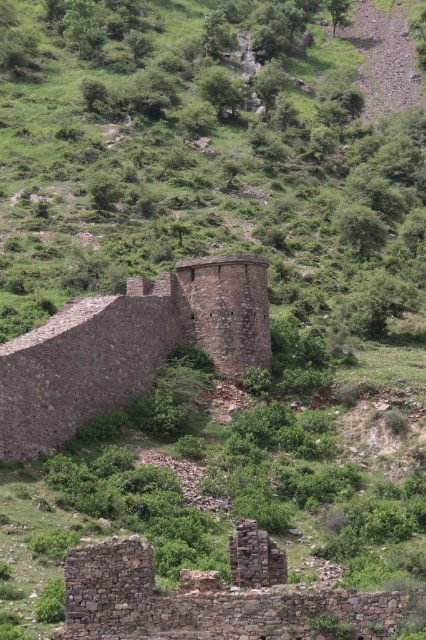
Can you confirm if brown stone wall at center is taller than rusty stone ruins at lower left?

Yes, brown stone wall at center is taller than rusty stone ruins at lower left.

Where is `brown stone wall at center`? brown stone wall at center is located at coordinates (127, 346).